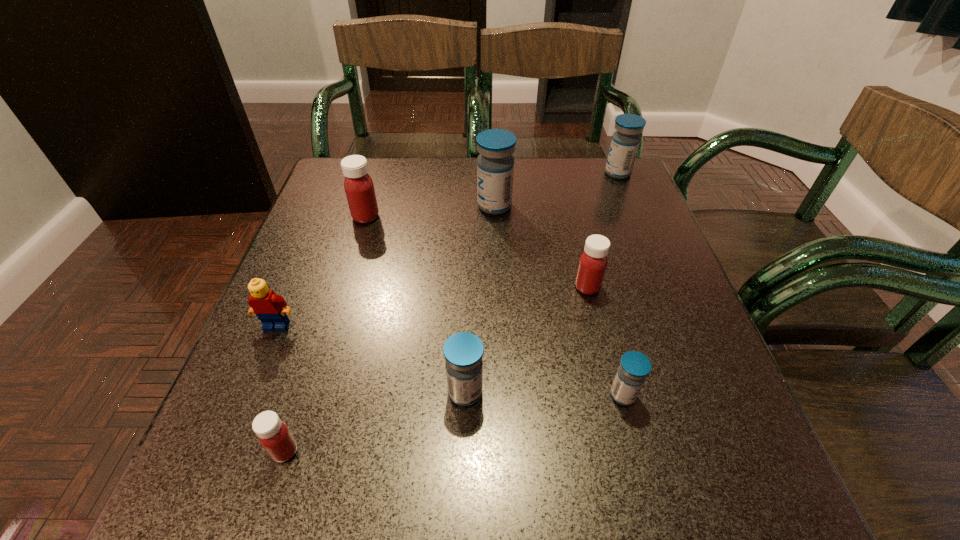
The height and width of the screenshot is (540, 960). I want to click on vacant space that is in between the rightmost blue medicine and the smallest blue medicine, so [620, 284].

Where is `free space between the third biggest blue medicine and the fifth nearest object`? free space between the third biggest blue medicine and the fifth nearest object is located at coordinates (526, 340).

Image resolution: width=960 pixels, height=540 pixels. Identify the location of free space between the farthest red medicine and the third blue medicine from left to right. (494, 306).

What are the coordinates of `free space between the rightmost blue medicine and the fifth farthest object` in the screenshot? It's located at (447, 249).

Locate an element on the screen. The height and width of the screenshot is (540, 960). free spot between the rightmost medicine and the smallest red medicine is located at coordinates (451, 312).

Find the location of `free point between the nearest object and the smallest blue medicine`. free point between the nearest object and the smallest blue medicine is located at coordinates (454, 423).

In order to click on vacant area that lies between the smallest blue medicine and the nearest red medicine in this screenshot , I will do `click(454, 423)`.

Where is `free spot between the tallest medicine and the nearest red medicine`? This screenshot has width=960, height=540. free spot between the tallest medicine and the nearest red medicine is located at coordinates tap(390, 328).

You are a GUI agent. You are given a task and a screenshot of the screen. Output one action in this format:
    pyautogui.click(x=<x>, y=<y>)
    Task: Click on the free point between the second farthest blue medicine and the fourth nearest object
    Image resolution: width=960 pixels, height=540 pixels.
    Given the screenshot: What is the action you would take?
    pyautogui.click(x=386, y=266)

Where is `empty location between the second smallest blue medicine and the farthest red medicine`? This screenshot has height=540, width=960. empty location between the second smallest blue medicine and the farthest red medicine is located at coordinates (416, 305).